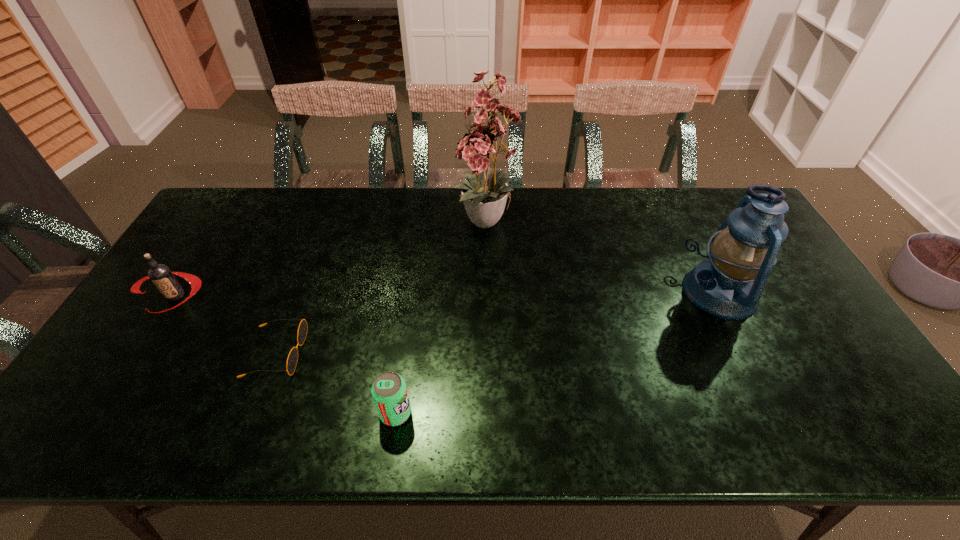
The width and height of the screenshot is (960, 540). Find the location of `blank region between the farthest object and the second tallest object`. blank region between the farthest object and the second tallest object is located at coordinates (604, 258).

Find the location of `empty space that is in between the third shortest object and the shortest object`. empty space that is in between the third shortest object and the shortest object is located at coordinates pos(226,325).

Where is `free space between the sunglasses and the leftmost object`? free space between the sunglasses and the leftmost object is located at coordinates (226, 325).

Locate an element on the screen. empty space that is in between the nearest object and the second tallest object is located at coordinates (558, 353).

Find the location of a particular element. This screenshot has height=540, width=960. the fourth closest object to the tallest object is located at coordinates (162, 277).

Locate which object is the third closest to the second object from left to right. Please provide its 2D coordinates. Your answer should be formatted as a tuple, i.e. [(x, y)], where the tuple contains the x and y coordinates of a point satisfying the conditions above.

[(484, 196)]

Image resolution: width=960 pixels, height=540 pixels. I want to click on free space that satisfies the following two spatial constraints: 1. on the front-facing side of the flower arrangement; 2. on the front-facing side of the fourth tallest object, so click(x=492, y=413).

Find the location of a particular element. This screenshot has height=540, width=960. free space that satisfies the following two spatial constraints: 1. on the front-facing side of the farthest object; 2. on the front-facing side of the nearest object is located at coordinates (492, 413).

Where is `vacant space that satisfies the following two spatial constraints: 1. on the face of the rightmost object; 2. on the label of the root beer`? This screenshot has width=960, height=540. vacant space that satisfies the following two spatial constraints: 1. on the face of the rightmost object; 2. on the label of the root beer is located at coordinates (722, 296).

Where is `free location that satisfies the following two spatial constraints: 1. on the front-facing side of the farthest object; 2. on the front-facing side of the nearest object`? free location that satisfies the following two spatial constraints: 1. on the front-facing side of the farthest object; 2. on the front-facing side of the nearest object is located at coordinates click(492, 413).